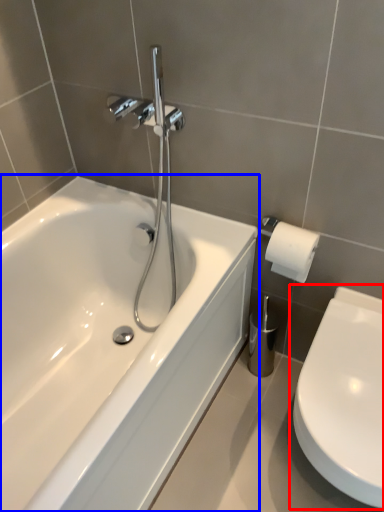
Question: Which point is closer to the camera, toilet (highlighted by a red box) or bathtub (highlighted by a blue box)?

Choices:
 (A) toilet
 (B) bathtub

Answer: (B)